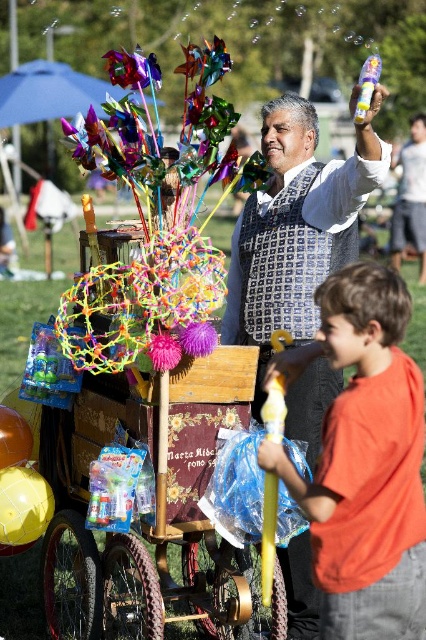
Question: Is patterned fabric vest at center to the left of purple fuzzy ball at center from the viewer's perspective?

Choices:
 (A) yes
 (B) no

Answer: (B)

Question: Can you confirm if purple fuzzy ball at center is positioned to the left of translucent plastic bubble wand at upper center?

Choices:
 (A) yes
 (B) no

Answer: (A)

Question: Based on their relative distances, which object is farther from the purple fuzzy ball at center?

Choices:
 (A) translucent plastic bubble wand at upper center
 (B) patterned fabric vest at center
 (C) purple fuzzy flower at center

Answer: (B)

Question: Does orange matte shirt at right appear over purple fuzzy ball at center?

Choices:
 (A) no
 (B) yes

Answer: (A)

Question: Estimate the real-world distances between objects in this image. Which object is closer to the patterned fabric vest at center?

Choices:
 (A) translucent plastic bubble wand at upper center
 (B) orange matte shirt at right

Answer: (A)

Question: Which of the following is the closest to the observer?

Choices:
 (A) (175, 348)
 (B) (247, 273)
 (C) (362, 525)

Answer: (C)